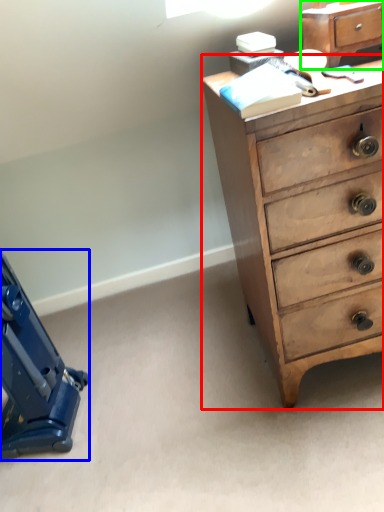
Question: Which object is positioned farthest from chest of drawers (highlighted by a red box)? Select from equipment (highlighted by a blue box) and file cabinet (highlighted by a green box).

Choices:
 (A) equipment
 (B) file cabinet

Answer: (A)